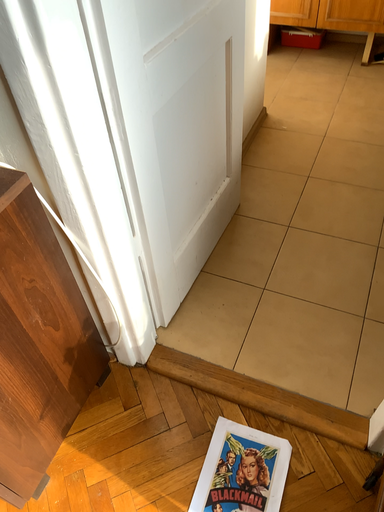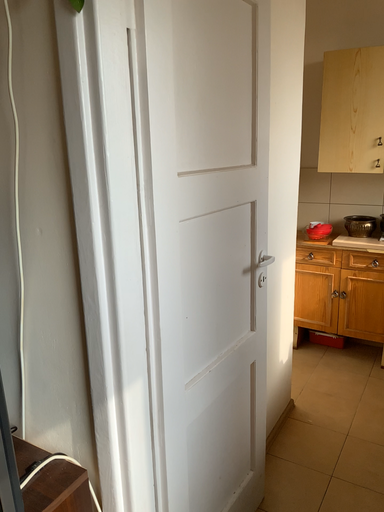
Question: How did the camera likely rotate when shooting the video?

Choices:
 (A) rotated upward
 (B) rotated downward

Answer: (A)